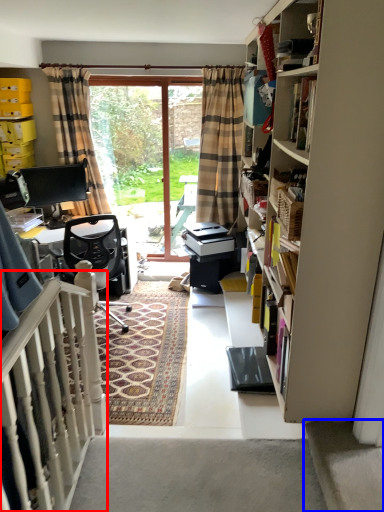
Question: Among these objects, which one is nearest to the camera, balustrade (highlighted by a red box) or stairwell (highlighted by a blue box)?

Choices:
 (A) balustrade
 (B) stairwell

Answer: (A)